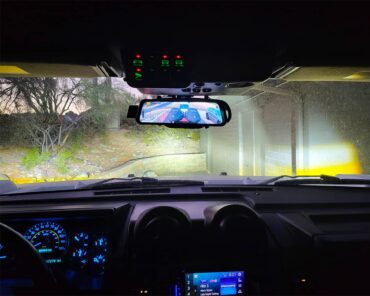
Image resolution: width=370 pixels, height=296 pixels. I want to click on brick wall, so click(172, 162).